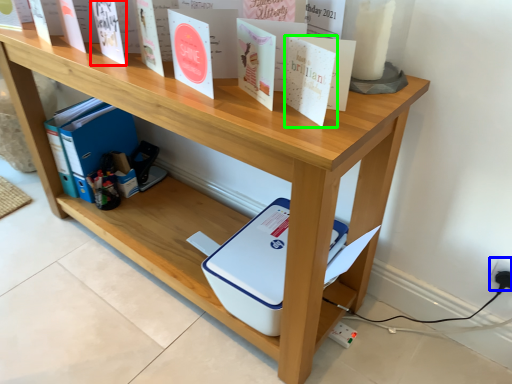
Question: Considering the real-world distances, which object is farthest from paperback book (highlighted by a red box)? electric outlet (highlighted by a blue box) or paperback book (highlighted by a green box)?

Choices:
 (A) electric outlet
 (B) paperback book

Answer: (A)